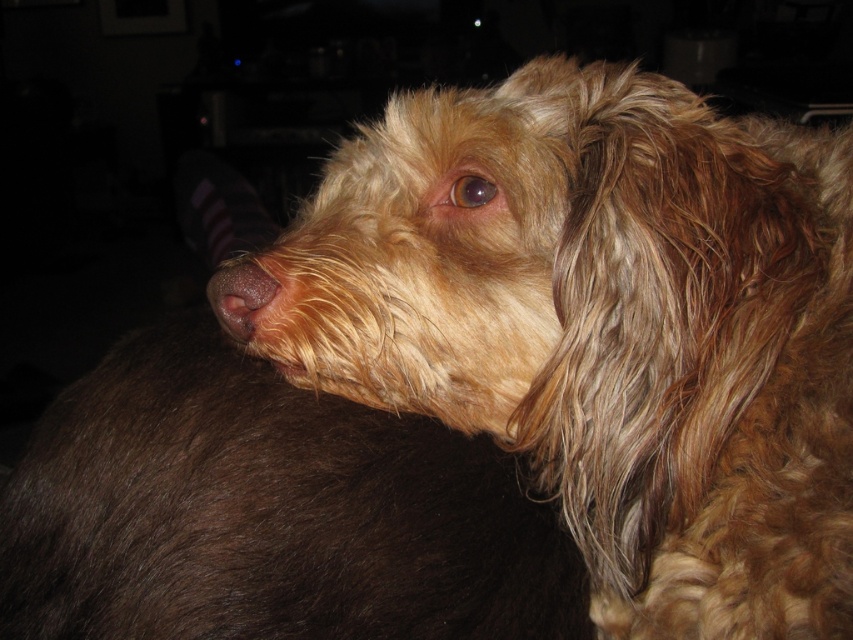
You are standing in a living room and see the fuzzy brown dog at center. If you want to place a small toy exactly where the dog is resting its head, what are the coordinates you should use?

The coordinates for the fuzzy brown dog at center are at point (608, 328), so you should place the small toy at those coordinates.

You are a photographer trying to capture the dog in the image. You want to ensure the brown matte nose at center and the brown fur eye at center are both clearly visible in your shot. Which object should you focus on first to make sure both are in frame?

The brown matte nose at center is positioned on the left side of brown fur eye at center. To ensure both are in frame, focus on the brown fur eye at center first since it is on the right, allowing you to adjust the frame to include the nose on the left.

You are a photographer setting up a shot in a living room. You have two points marked on your camera screen at coordinates point (740, 499) and point (498, 205). You want to place a small decorative item so that it is only visible in the foreground. Which point should you place the item at?

You should place the decorative item at point (740, 499) because it is in front of point (498, 205), making it the foreground position.